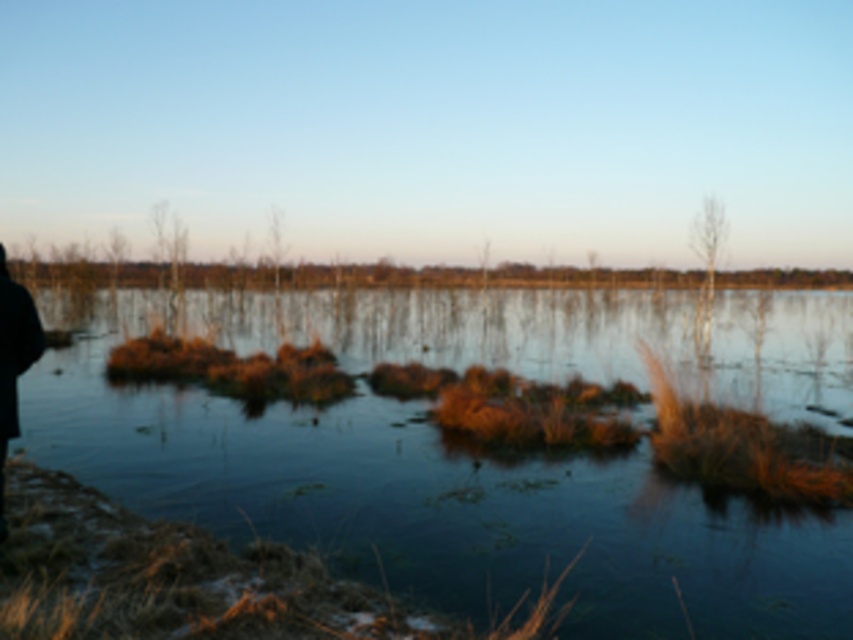
You are standing at the edge of the brown grassy lake at center. There is a point marked at coordinates (474, 451). Is this point located on the lake or on the grassy area?

The point at coordinates (474, 451) is on the brown grassy lake at center, so it is located on the lake.

You are standing at the edge of the brown grassy lake at center and want to reach the black fabric person at left. Which direction should you move to get closer to them?

Since the brown grassy lake at center is closer to the viewer than the black fabric person at left, you should move towards the left to get closer to the black fabric person at left.

You are standing in the wetland scene and want to move from the black fabric person at left to the brown grassy lake at center. In which direction should you walk?

You should walk to the right to reach the brown grassy lake at center from the black fabric person at left because the brown grassy lake at center is located to the right of the black fabric person at left.